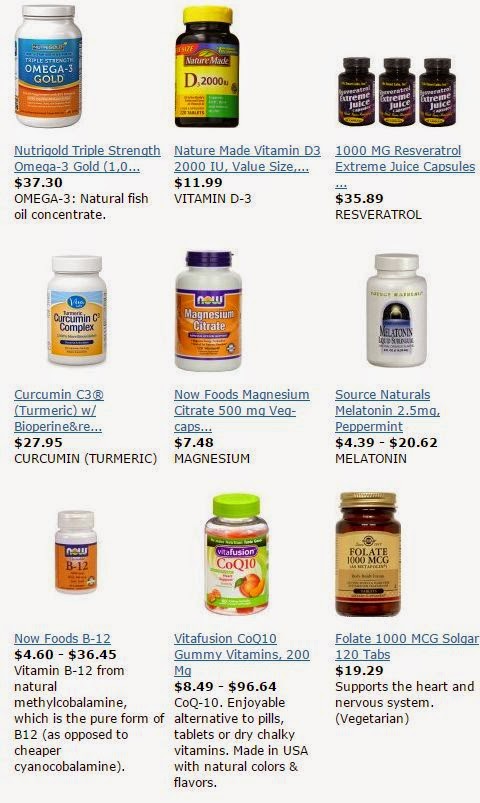
Where is `golden metal screw cap`? The height and width of the screenshot is (803, 480). golden metal screw cap is located at coordinates (355, 499).